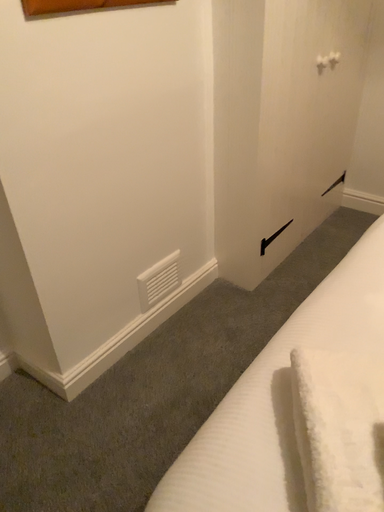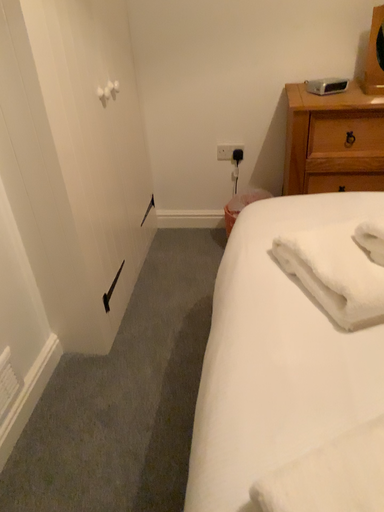
Question: Which way did the camera rotate in the video?

Choices:
 (A) rotated downward
 (B) rotated upward

Answer: (B)